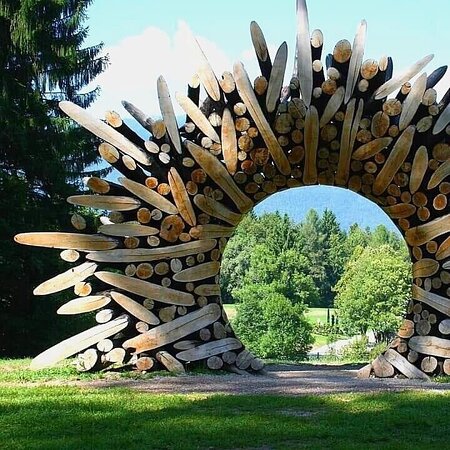
This screenshot has height=450, width=450. In order to click on work of art in this screenshot , I will do `click(238, 155)`.